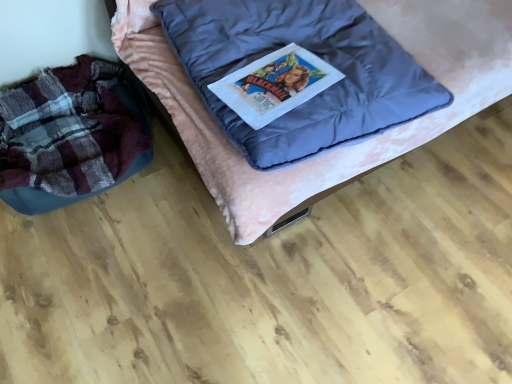
Locate an element on the screen. The width and height of the screenshot is (512, 384). velvet pink bed at center is located at coordinates (339, 148).

What do you see at coordinates (339, 148) in the screenshot?
I see `velvet pink bed at center` at bounding box center [339, 148].

The width and height of the screenshot is (512, 384). Describe the element at coordinates (70, 136) in the screenshot. I see `plaid fabric bean bag at left` at that location.

The height and width of the screenshot is (384, 512). I want to click on plaid fabric bean bag at left, so click(x=70, y=136).

Locate an element on the screen. The image size is (512, 384). velvet pink bed at center is located at coordinates (339, 148).

Does velvet pink bed at center appear on the left side of plaid fabric bean bag at left?

Incorrect, velvet pink bed at center is not on the left side of plaid fabric bean bag at left.

Which is behind, velvet pink bed at center or plaid fabric bean bag at left?

plaid fabric bean bag at left.

Considering the points (423, 47) and (59, 107), which point is in front, point (423, 47) or point (59, 107)?

Point (423, 47)

From the image's perspective, is velvet pink bed at center beneath plaid fabric bean bag at left?

No, from the image's perspective, velvet pink bed at center is not below plaid fabric bean bag at left.

From a real-world perspective, is velvet pink bed at center over plaid fabric bean bag at left?

Yes, from a real-world perspective, velvet pink bed at center is over plaid fabric bean bag at left

Considering the relative sizes of velvet pink bed at center and plaid fabric bean bag at left in the image provided, is velvet pink bed at center thinner than plaid fabric bean bag at left?

No, velvet pink bed at center is not thinner than plaid fabric bean bag at left.

Between velvet pink bed at center and plaid fabric bean bag at left, which one has more height?

Standing taller between the two is velvet pink bed at center.

Between velvet pink bed at center and plaid fabric bean bag at left, which one has larger size?

velvet pink bed at center.

Is velvet pink bed at center completely or partially outside of plaid fabric bean bag at left?

Absolutely, velvet pink bed at center is external to plaid fabric bean bag at left.

Is velvet pink bed at center not close to plaid fabric bean bag at left?

They are positioned close to each other.

Is velvet pink bed at center looking in the opposite direction of plaid fabric bean bag at left?

velvet pink bed at center does not have its back to plaid fabric bean bag at left.

How many degrees apart are the facing directions of velvet pink bed at center and plaid fabric bean bag at left?

4.25e-05 degrees.

Locate an element on the screen. Image resolution: width=512 pixels, height=384 pixels. bean bag chair behind the velvet pink bed at center is located at coordinates (70, 136).

Which is more to the right, plaid fabric bean bag at left or velvet pink bed at center?

Positioned to the right is velvet pink bed at center.

Is plaid fabric bean bag at left behind velvet pink bed at center?

Yes.

Does point (84, 76) come behind point (444, 25)?

Yes, point (84, 76) is behind point (444, 25).

From the image's perspective, is plaid fabric bean bag at left beneath velvet pink bed at center?

Correct, plaid fabric bean bag at left appears lower than velvet pink bed at center in the image.

In the scene shown: From a real-world perspective, who is located higher, plaid fabric bean bag at left or velvet pink bed at center?

From a 3D spatial view, velvet pink bed at center is above.

Does plaid fabric bean bag at left have a greater width compared to velvet pink bed at center?

In fact, plaid fabric bean bag at left might be narrower than velvet pink bed at center.

Does plaid fabric bean bag at left have a lesser height compared to velvet pink bed at center?

Yes, plaid fabric bean bag at left is shorter than velvet pink bed at center.

Who is smaller, plaid fabric bean bag at left or velvet pink bed at center?

With smaller size is plaid fabric bean bag at left.

Is plaid fabric bean bag at left surrounding velvet pink bed at center?

Actually, velvet pink bed at center is outside plaid fabric bean bag at left.

Is plaid fabric bean bag at left far from velvet pink bed at center?

plaid fabric bean bag at left is actually quite close to velvet pink bed at center.

Is plaid fabric bean bag at left facing away from velvet pink bed at center?

No, plaid fabric bean bag at left's orientation is not away from velvet pink bed at center.

What's the angular difference between plaid fabric bean bag at left and velvet pink bed at center's facing directions?

4.25e-05 degrees.

How distant is plaid fabric bean bag at left from velvet pink bed at center?

19.24 inches.

This screenshot has height=384, width=512. I want to click on furniture located above the plaid fabric bean bag at left (from a real-world perspective), so click(339, 148).

There is a plaid fabric bean bag at left. Where is `furniture above it (from a real-world perspective)`? The width and height of the screenshot is (512, 384). furniture above it (from a real-world perspective) is located at coordinates (339, 148).

At what (x,y) coordinates should I click in order to perform the action: click on furniture on the right of the plaid fabric bean bag at left. Please return your answer as a coordinate pair (x, y). Looking at the image, I should click on (339, 148).